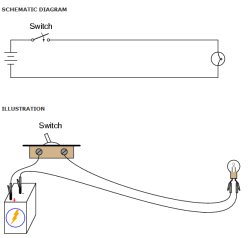
At what (x,y) coordinates should I click in order to perform the action: click on word "switch". Please return your answer as a coordinate pair (x, y). The image size is (250, 238). Looking at the image, I should click on (14, 217), (38, 28), (53, 126).